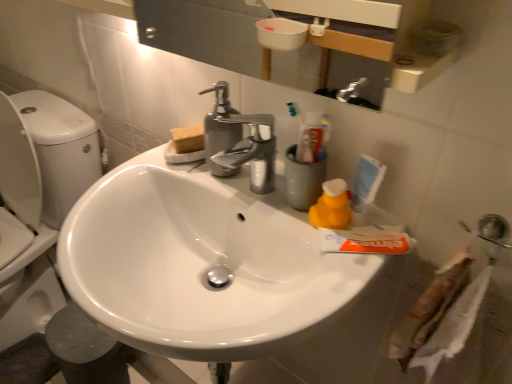
Image resolution: width=512 pixels, height=384 pixels. What are the coordinates of `free space in front of white matte toothpaste at center` in the screenshot? It's located at (330, 292).